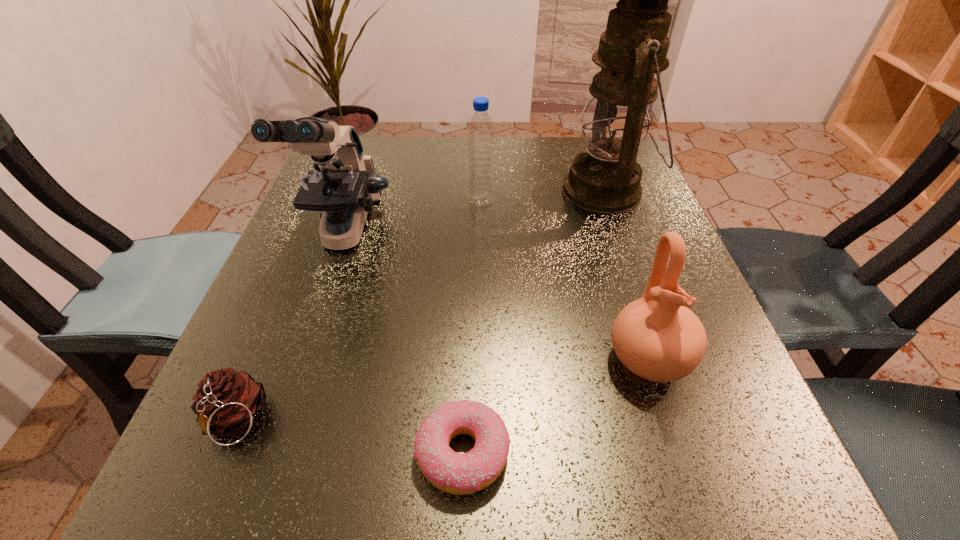
Locate an element on the screen. free spot between the pottery and the oil lamp is located at coordinates (627, 275).

Where is `vacant space that's between the pinecone and the pottery`? vacant space that's between the pinecone and the pottery is located at coordinates (442, 391).

Find the location of a particular element. vacant space that is in between the doughnut and the tallest object is located at coordinates (535, 322).

This screenshot has width=960, height=540. Identify the location of the second closest object to the water bottle. (345, 188).

Locate which object is the third closest to the water bottle. Please provide its 2D coordinates. Your answer should be formatted as a tuple, i.e. [(x, y)], where the tuple contains the x and y coordinates of a point satisfying the conditions above.

[(656, 337)]

The image size is (960, 540). I want to click on free region that satisfies the following two spatial constraints: 1. on the back side of the water bottle; 2. on the right side of the tallest object, so click(481, 191).